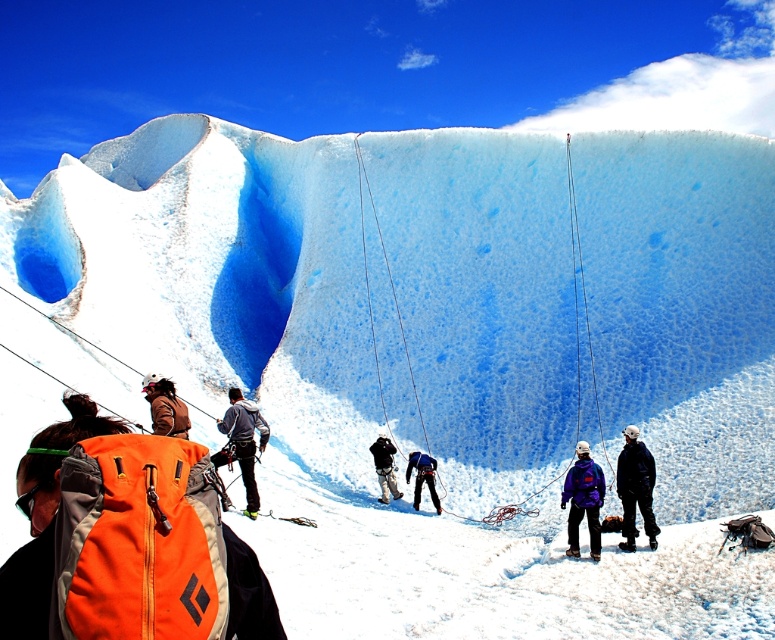
Question: Among these points, which one is nearest to the camera?

Choices:
 (A) (386, 461)
 (B) (176, 413)

Answer: (B)

Question: Where is purple fleece jacket at center located in relation to gray fabric jacket at center in the image?

Choices:
 (A) left
 (B) right

Answer: (B)

Question: Which of the following is the closest to the observer?

Choices:
 (A) orange fabric backpack at center
 (B) black matte jacket at center
 (C) purple fleece jacket at center
 (D) blue fabric climbing harness at center

Answer: (A)

Question: Which object is farther from the camera taking this photo?

Choices:
 (A) black fabric jacket at center
 (B) gray fabric jacket at center
 (C) orange fabric backpack at center
 (D) purple fleece jacket at center

Answer: (A)

Question: Can you confirm if orange fabric backpack at center is positioned below black matte jacket at center?

Choices:
 (A) yes
 (B) no

Answer: (B)

Question: Does purple fleece jacket at center appear over gray fabric jacket at center?

Choices:
 (A) yes
 (B) no

Answer: (B)